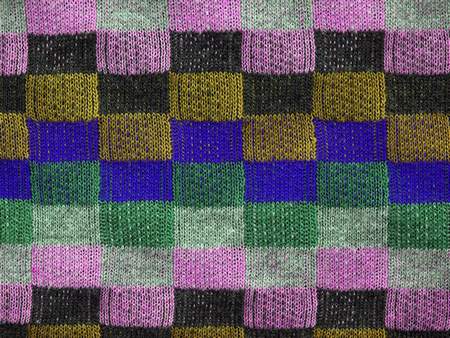
You are a GUI agent. You are given a task and a screenshot of the screen. Output one action in this format:
    pyautogui.click(x=<x>, y=<y>)
    Task: Click on the columns
    Image resolution: width=450 pixels, height=338 pixels.
    Given the screenshot: What is the action you would take?
    pyautogui.click(x=16, y=7), pyautogui.click(x=54, y=10), pyautogui.click(x=133, y=15), pyautogui.click(x=213, y=20), pyautogui.click(x=287, y=11), pyautogui.click(x=337, y=15), pyautogui.click(x=438, y=21)